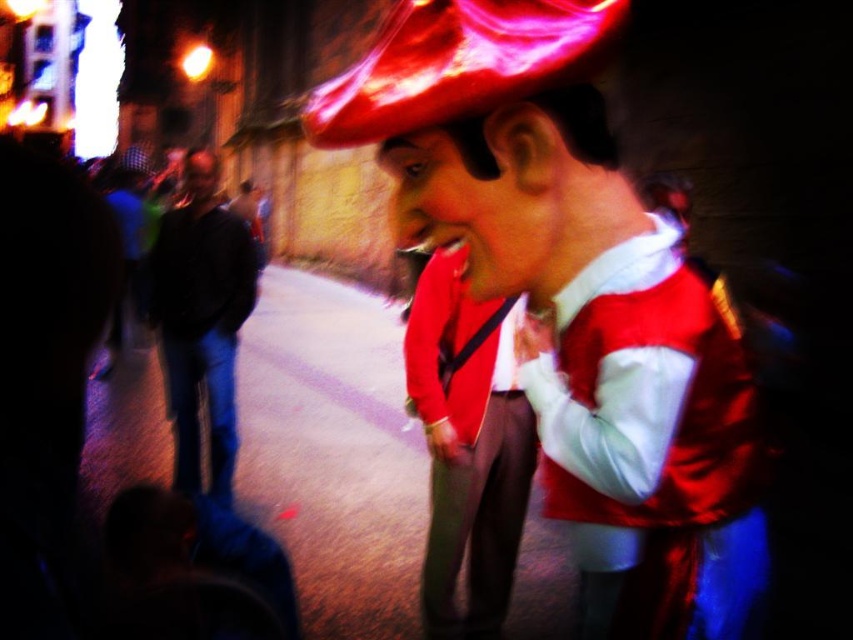
You are a photographer trying to capture a photo of the festive street scene. You want to ensure both the shiny red jacket at center and the black leather jacket at left are visible in your frame. Based on their positions, which jacket is closer to the right edge of the photo?

The shiny red jacket at center is positioned on the right side of the black leather jacket at left, so it is closer to the right edge of the photo.

You are a photographer trying to capture the perfect shot of the shiny satin vest at center. Given that the camera is focused at point 0.5, 0.5, will the vest be in focus?

The shiny satin vest at center is at point (651,445), which is further away from the focus point (426,320), so it may not be in focus.

You are a photographer trying to capture a clear shot of the shiny satin vest at center and the black leather jacket at left. Since the background is slightly blurred, can you tell which object is closer to the camera?

The shiny satin vest at center is in front of the black leather jacket at left, so it is closer to the camera.